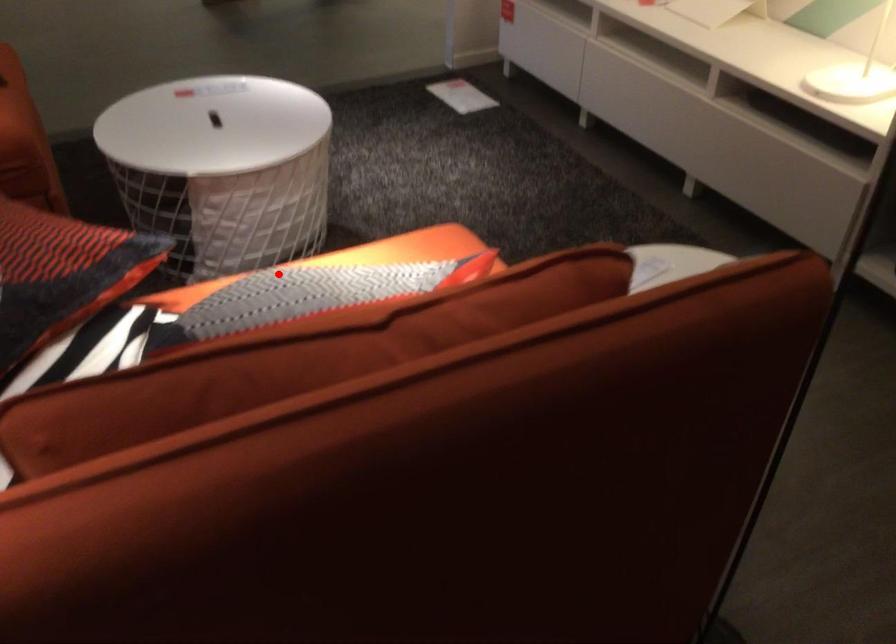
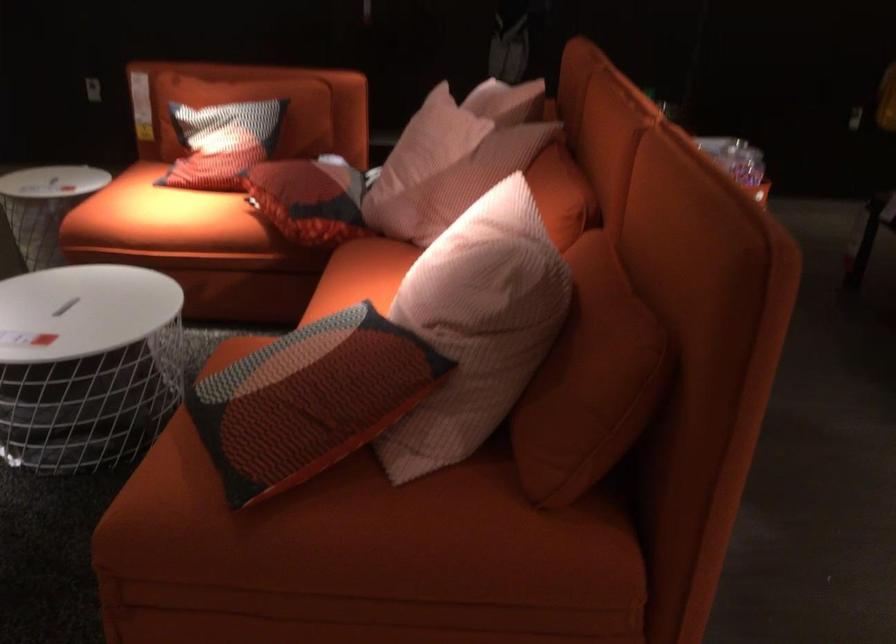
The point at the highlighted location is marked in the first image. Where is the corresponding point in the second image?

(222, 142)